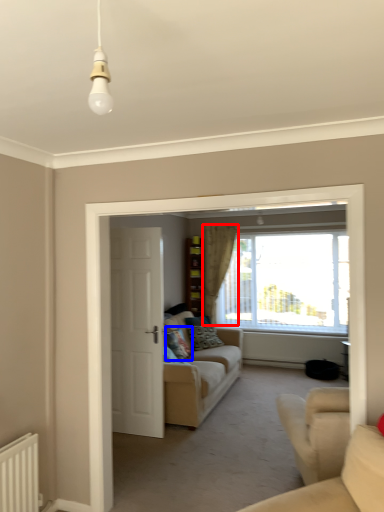
Question: Which of the following is the closest to the observer, curtain (highlighted by a red box) or pillow (highlighted by a blue box)?

Choices:
 (A) curtain
 (B) pillow

Answer: (B)